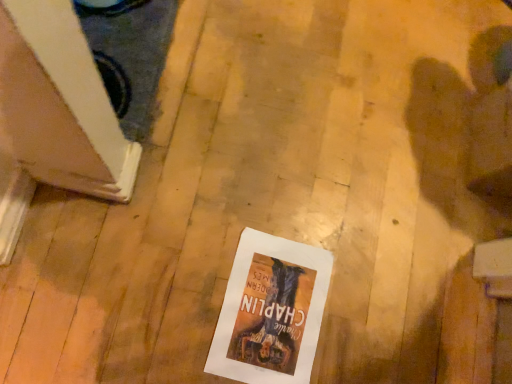
Locate an element on the screen. Image resolution: width=512 pixels, height=384 pixels. vacant space in white paper poster at center (from a real-world perspective) is located at coordinates pyautogui.click(x=274, y=308).